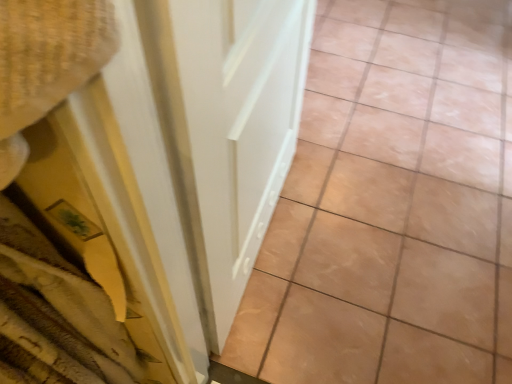
Locate an element on the screen. free space to the back side of white glossy door at center is located at coordinates (338, 144).